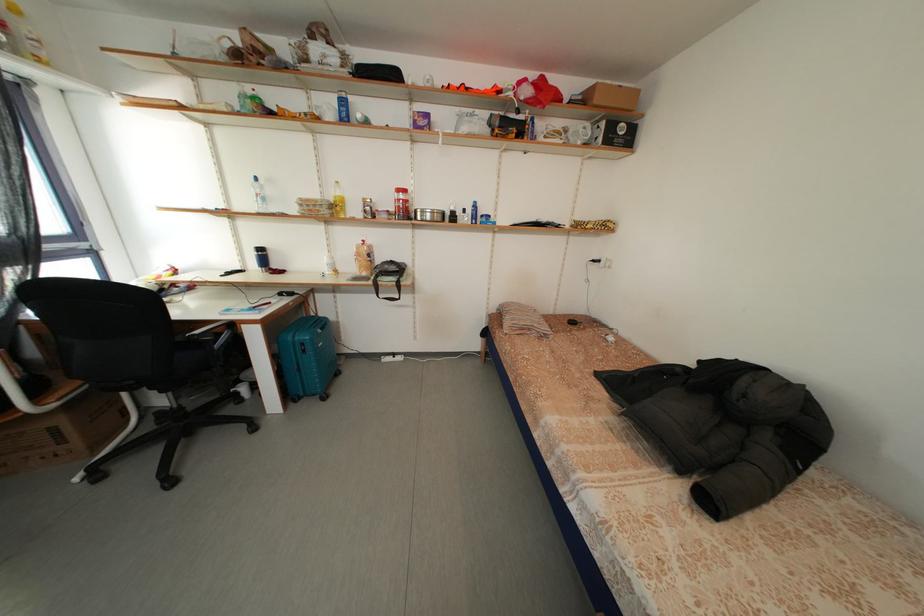
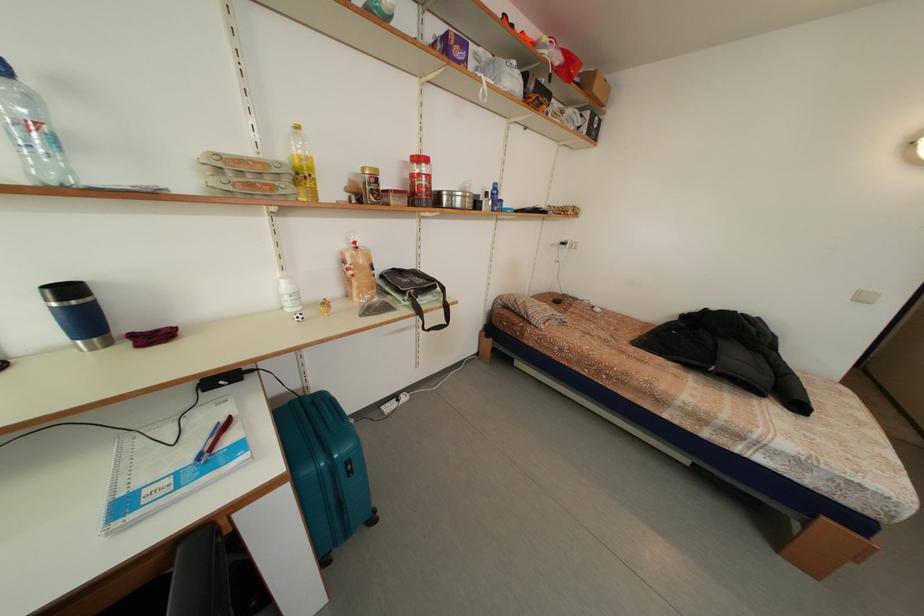
Locate, in the second image, the point that corresponds to point (344, 207) in the first image.

(310, 172)